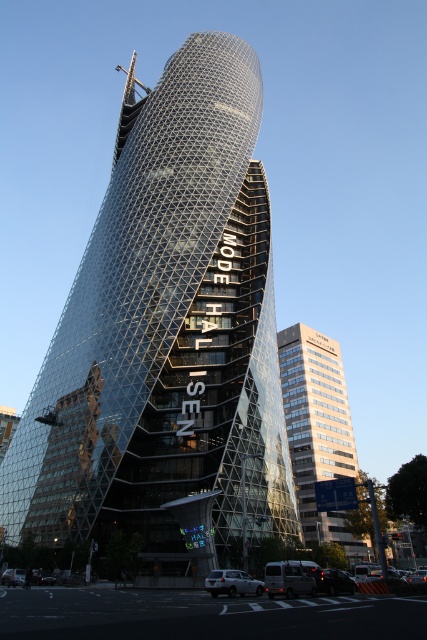
Question: Which object appears closest to the camera in this image?

Choices:
 (A) silver metallic car at center
 (B) transparent glass tower at center
 (C) silver metallic van at lower center

Answer: (A)

Question: Which of the following is the closest to the observer?

Choices:
 (A) (242, 570)
 (B) (318, 468)
 (C) (341, 577)
 (D) (251, 449)

Answer: (C)

Question: Is transparent glass tower at center to the left of silver metallic van at lower center from the viewer's perspective?

Choices:
 (A) no
 (B) yes

Answer: (B)

Question: Does transparent glass tower at center appear over light beige glass building at center?

Choices:
 (A) no
 (B) yes

Answer: (B)

Question: Which of the following is the farthest from the observer?

Choices:
 (A) (335, 364)
 (B) (111, 369)
 (C) (333, 588)
 (D) (245, 588)

Answer: (A)

Question: Can you confirm if silver metallic van at lower center is positioned above silver metallic car at center?

Choices:
 (A) yes
 (B) no

Answer: (B)